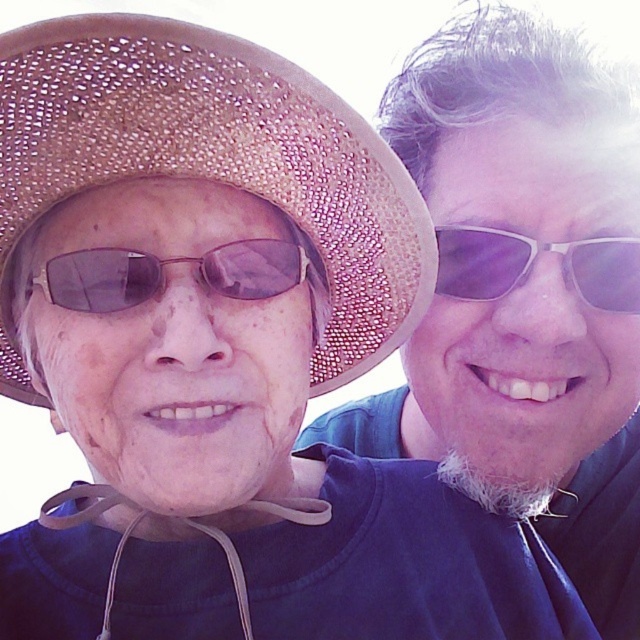
Question: Which point appears closest to the camera in this image?

Choices:
 (A) pos(355,410)
 (B) pos(349,179)

Answer: (B)

Question: Which of the following is the closest to the observer?

Choices:
 (A) sunglassestransparentglasses at right
 (B) matte black shirt at upper right
 (C) strawhat at center

Answer: (C)

Question: Which of these objects is positioned farthest from the sunglasses at center?

Choices:
 (A) matte black shirt at upper right
 (B) sunglassestransparentglasses at right
 (C) strawhat at center

Answer: (A)

Question: Is strawhat at center further to the viewer compared to sunglasses at center?

Choices:
 (A) no
 (B) yes

Answer: (A)

Question: Can you confirm if sunglasses at center is positioned to the right of sunglassestransparentglasses at right?

Choices:
 (A) no
 (B) yes

Answer: (A)

Question: Is strawhat at center positioned before sunglassestransparentglasses at right?

Choices:
 (A) yes
 (B) no

Answer: (A)